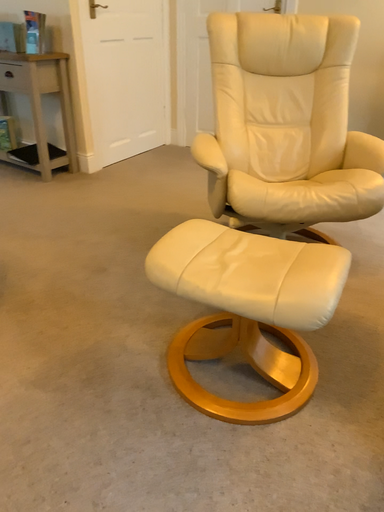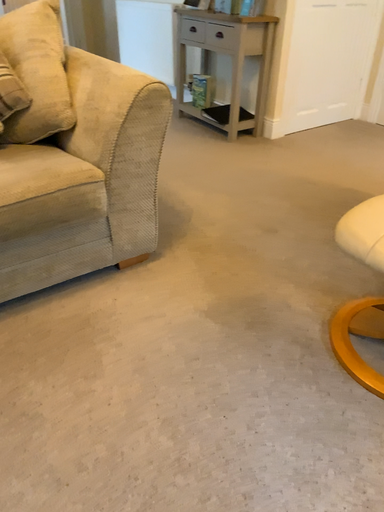
Question: How did the camera likely rotate when shooting the video?

Choices:
 (A) rotated left
 (B) rotated right

Answer: (A)